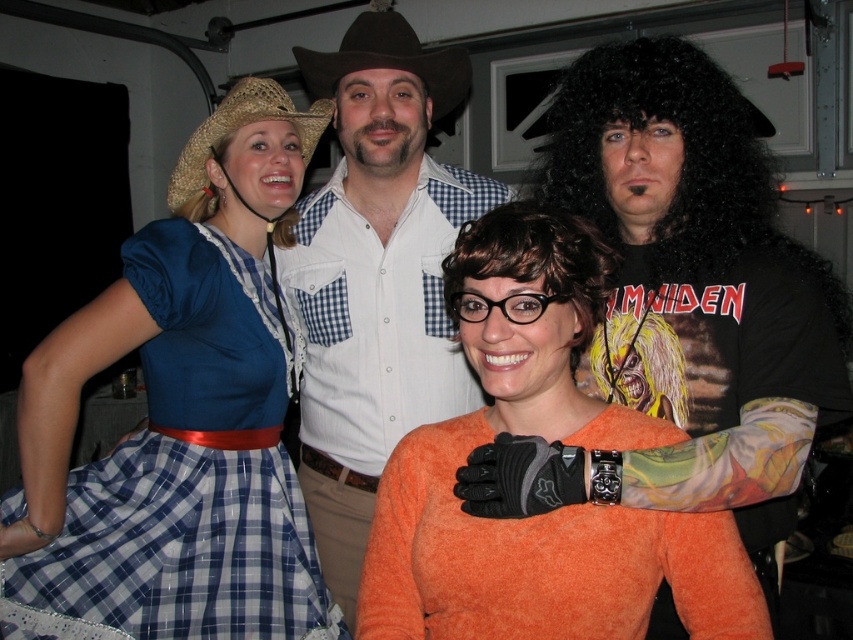
Is black leather jacket at center in front of strawhat at upper left?

Yes, it is in front of strawhat at upper left.

Based on the photo, does black leather jacket at center appear under strawhat at upper left?

Indeed, black leather jacket at center is positioned under strawhat at upper left.

Is point (733, 186) farther from viewer compared to point (201, 125)?

No.

Locate an element on the screen. Image resolution: width=853 pixels, height=640 pixels. black leather jacket at center is located at coordinates (698, 285).

Is black leather jacket at center to the right of white checkered shirt at center from the viewer's perspective?

Yes, black leather jacket at center is to the right of white checkered shirt at center.

Can you confirm if black leather jacket at center is thinner than white checkered shirt at center?

Incorrect, black leather jacket at center's width is not less than white checkered shirt at center's.

Is point (572, 81) behind point (450, 182)?

No, it is in front of (450, 182).

Find the location of a particular element. This screenshot has height=640, width=853. black leather jacket at center is located at coordinates (698, 285).

Which is behind, point (741, 136) or point (387, 12)?

Point (387, 12)

Who is more forward, (x=593, y=188) or (x=335, y=70)?

Positioned in front is point (x=593, y=188).

Who is more forward, (592,68) or (447,52)?

Point (592,68) is more forward.

Locate an element on the screen. black leather jacket at center is located at coordinates (698, 285).